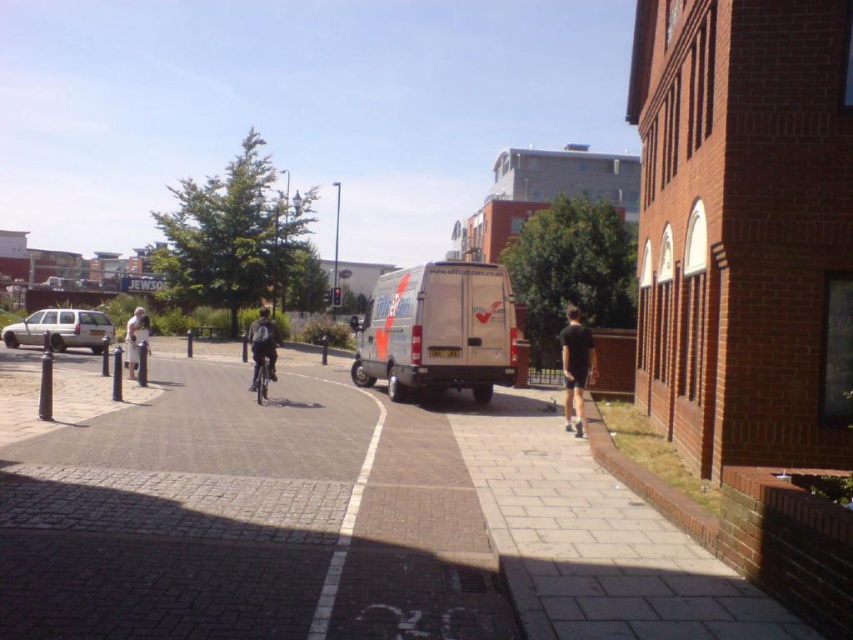
Can you confirm if black fabric shorts at center-right is wider than shiny metallic bicycle at center?

Yes, black fabric shorts at center-right is wider than shiny metallic bicycle at center.

Between point (567, 314) and point (257, 385), which one is positioned behind?

Point (567, 314)

What do you see at coordinates (575, 368) in the screenshot? I see `black fabric shorts at center-right` at bounding box center [575, 368].

The width and height of the screenshot is (853, 640). Identify the location of black fabric shorts at center-right. (575, 368).

Is point (129, 323) less distant than point (264, 353)?

No, (129, 323) is behind (264, 353).

Is light beige jacket at center-left below shiny metallic bicycle at center?

No.

Find the location of a particular element. The width and height of the screenshot is (853, 640). light beige jacket at center-left is located at coordinates (135, 339).

Locate an element on the screen. The image size is (853, 640). light beige jacket at center-left is located at coordinates (135, 339).

Who is more distant from viewer, (41, 339) or (137, 353)?

Point (41, 339)

Is point (91, 346) more distant than point (132, 340)?

Yes, it is.

Is point (88, 342) closer to viewer compared to point (136, 326)?

No, it is not.

This screenshot has height=640, width=853. What are the coordinates of `silver metallic car at left` in the screenshot? It's located at (61, 330).